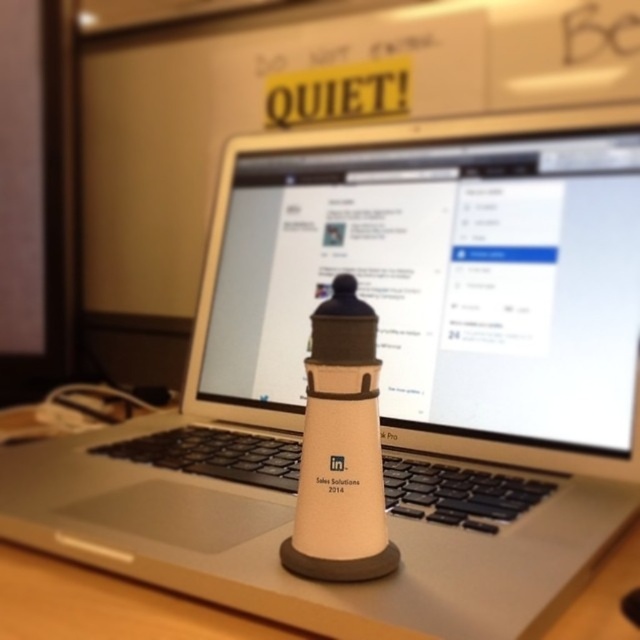
Which is above, white matte computer screen at center or white matte table at center?

white matte computer screen at center

Identify the location of white matte computer screen at center. (436, 280).

At what (x,y) coordinates should I click in order to perform the action: click on white matte computer screen at center. Please return your answer as a coordinate pair (x, y). The image size is (640, 640). Looking at the image, I should click on (436, 280).